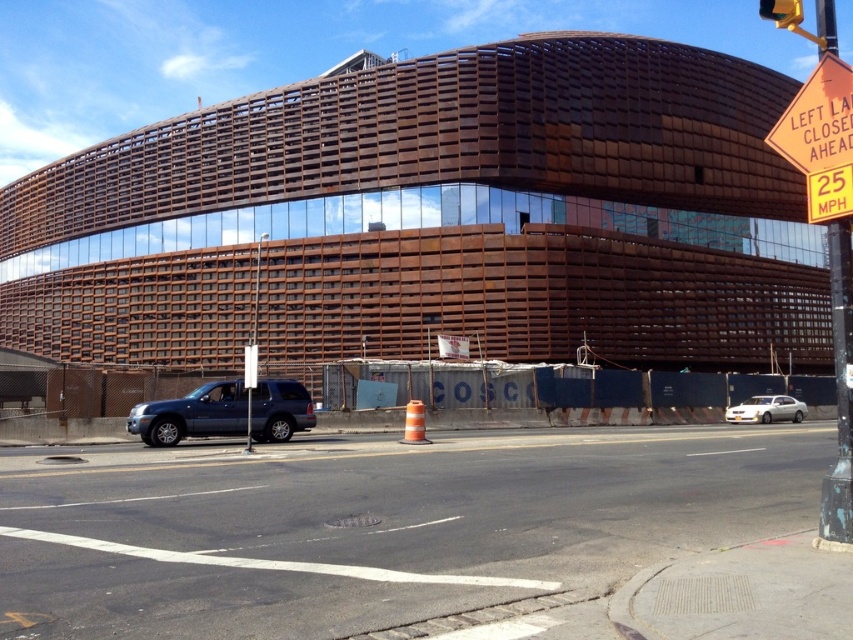
You are a delivery driver approaching the street corner in the image. You need to park your vehicle on the black asphalt at lower center. Considering the width of the yellow plastic traffic light at upper right, will there be enough space for your vehicle to park without hitting the traffic light?

The black asphalt at lower center has a lesser width compared to the yellow plastic traffic light at upper right, meaning the parking space is narrower than the traffic light. Therefore, parking your vehicle there might result in hitting the traffic light due to insufficient space.

You are a city planner assessing the distance between the rustic wood building at center and the metallic pole at right for pedestrian pathway planning. Given that the minimum required distance for a safe pathway is 40 meters, is the current distance sufficient?

The rustic wood building at center and metallic pole at right are 39.31 meters apart, which is less than the required 40 meters. Therefore, the current distance is insufficient for a safe pedestrian pathway.